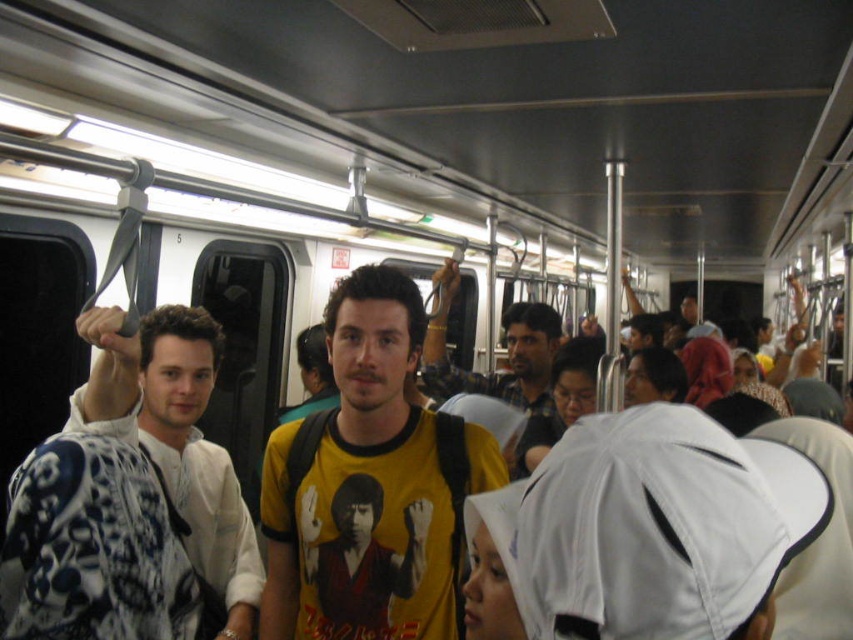
Question: Which point is closer to the camera?

Choices:
 (A) white textured shirt at left
 (B) yellow printed t-shirt at center

Answer: (A)

Question: Which of the following is the farthest from the observer?

Choices:
 (A) white textured shirt at left
 (B) yellow printed t-shirt at center

Answer: (B)

Question: Does white textured shirt at left appear on the left side of yellow printed t-shirt at center?

Choices:
 (A) yes
 (B) no

Answer: (A)

Question: Which object is positioned closest to the white textured shirt at left?

Choices:
 (A) yellow printed t-shirt at center
 (B) yellow matte t-shirt at center

Answer: (B)

Question: Observing the image, what is the correct spatial positioning of yellow matte t-shirt at center in reference to yellow printed t-shirt at center?

Choices:
 (A) above
 (B) below

Answer: (B)

Question: In this image, where is yellow matte t-shirt at center located relative to yellow printed t-shirt at center?

Choices:
 (A) below
 (B) above

Answer: (A)